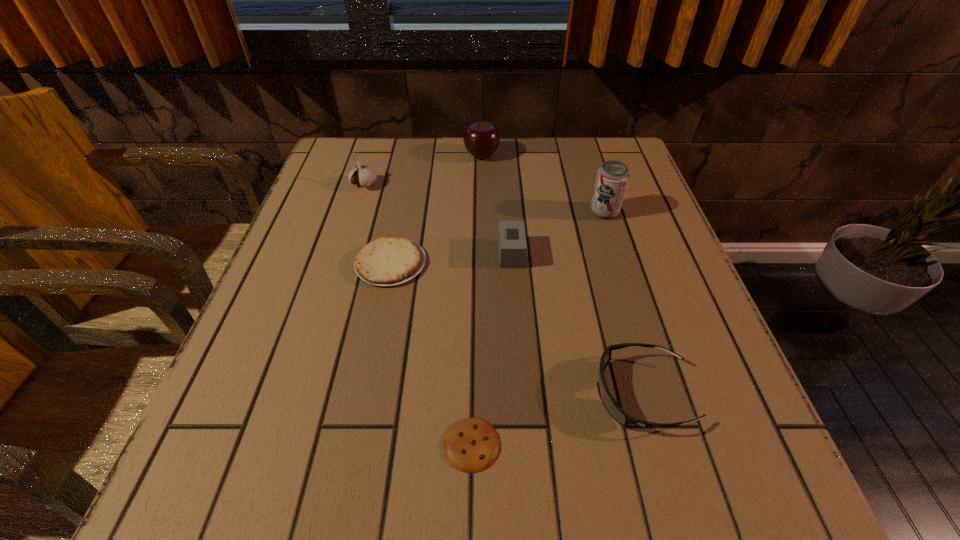
Locate an element on the screen. This screenshot has width=960, height=540. vacant point located between the tallest object and the alarm clock is located at coordinates (558, 233).

This screenshot has width=960, height=540. What are the coordinates of `vacant point located between the farthest object and the tortilla` in the screenshot? It's located at (436, 209).

The image size is (960, 540). Identify the location of unoccupied position between the shortest object and the garlic. (419, 314).

The width and height of the screenshot is (960, 540). Identify the location of free point between the goggles and the cookie. (557, 418).

You are a GUI agent. You are given a task and a screenshot of the screen. Output one action in this format:
    pyautogui.click(x=<x>, y=<y>)
    Task: Click on the empty location between the fifth nearest object and the alarm clock
    Image resolution: width=960 pixels, height=540 pixels.
    Given the screenshot: What is the action you would take?
    pyautogui.click(x=558, y=233)

I want to click on object that is the sixth closest to the goggles, so click(x=364, y=176).

Find the location of `object that is the sixth closest one to the goggles`. object that is the sixth closest one to the goggles is located at coordinates (364, 176).

Locate an element on the screen. vacant space that satisfies the following two spatial constraints: 1. on the front side of the cookie; 2. on the right side of the garlic is located at coordinates coord(282,444).